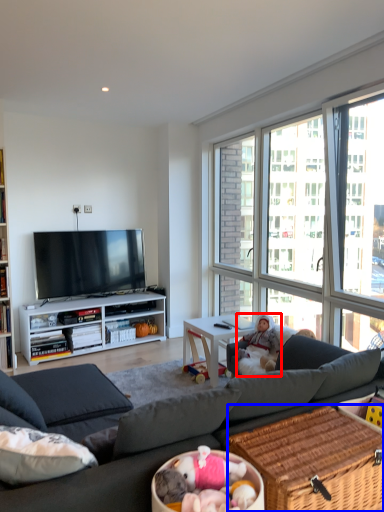
Question: Which object appears closest to the camera in this image, person (highlighted by a red box) or picnic basket (highlighted by a blue box)?

Choices:
 (A) person
 (B) picnic basket

Answer: (B)